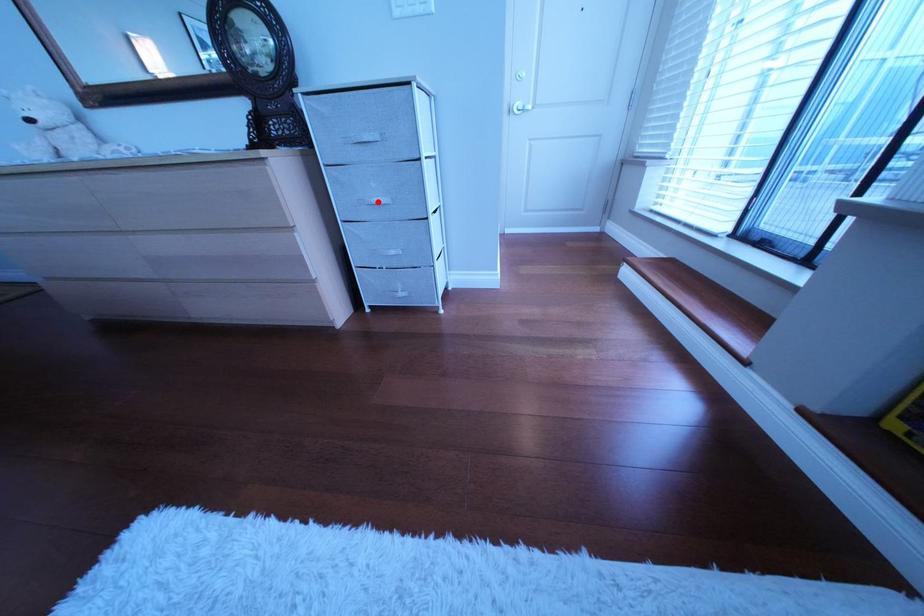
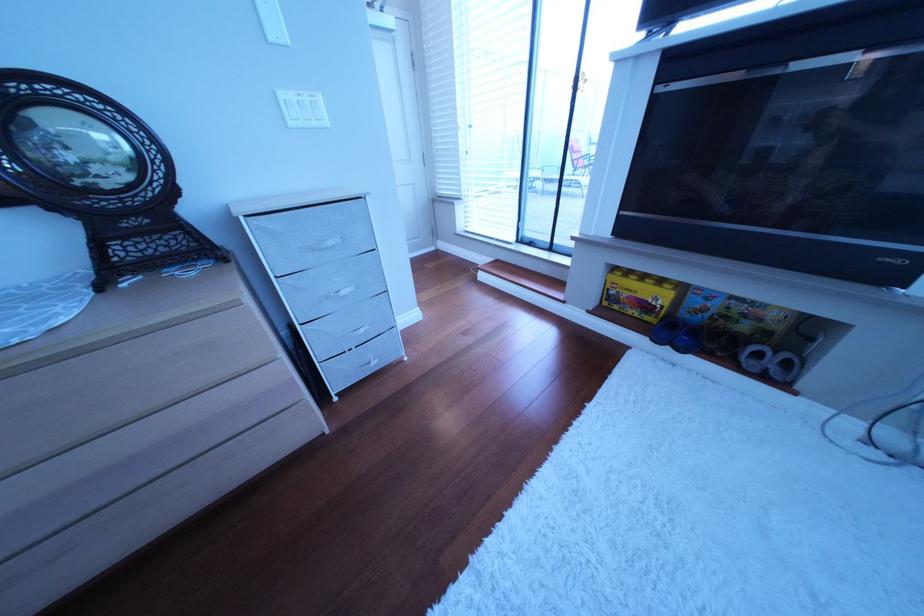
Locate, in the second image, the point that corresponds to the highlighted location in the first image.

(339, 299)